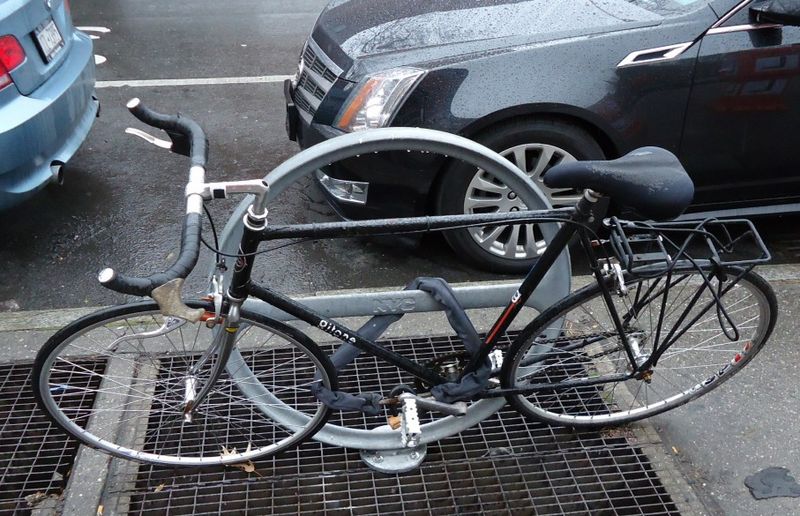
The image size is (800, 516). I want to click on seat is wider in the back, so click(642, 183).